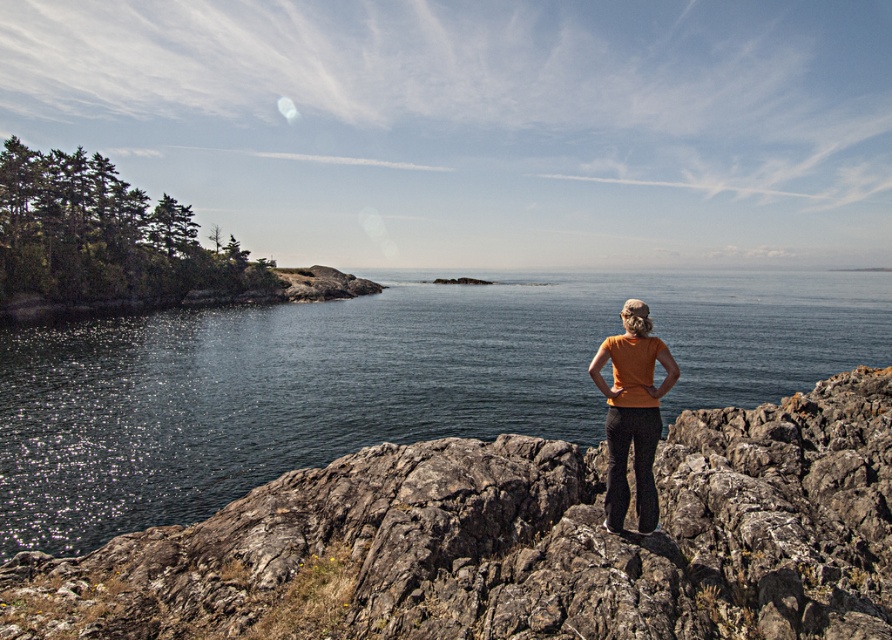
You are a photographer trying to capture the orange cotton shirt at center and the rough textured rock at center in the same frame. Based on their positions, which object would you need to focus on first if you start from the left side of the image and move towards the right?

The orange cotton shirt at center is to the left of the rough textured rock at center, so you would need to focus on the orange cotton shirt at center first as you move from left to right.

You are a hiker who wants to cross from the rough textured rock at center to the person on the right side of the frame. The hiker has a 15 feet long rope. Is the rope long enough to reach the person?

The distance between the rough textured rock at center and the person on the right side of the frame is 20.08 feet. The rope is only 15 feet long, so it is not long enough to reach the person.